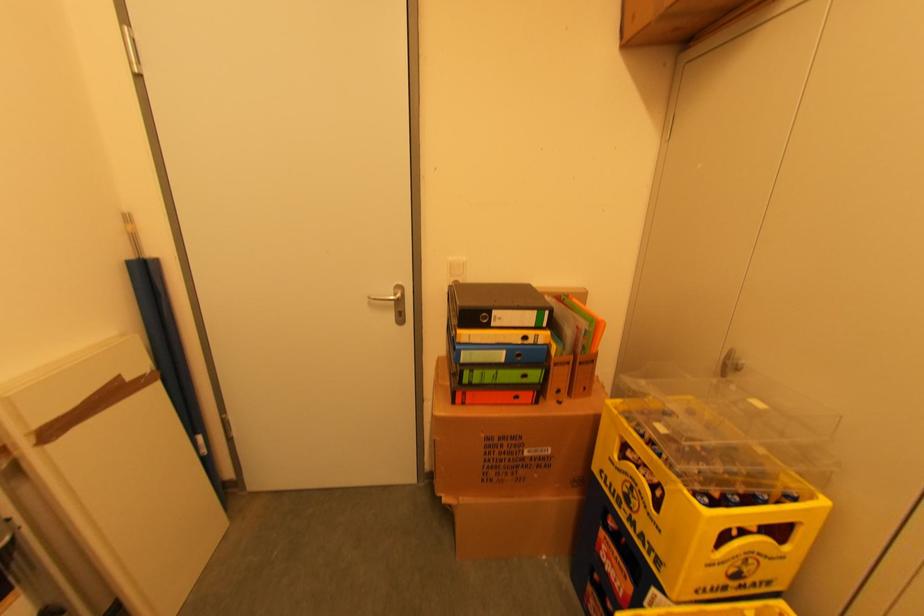
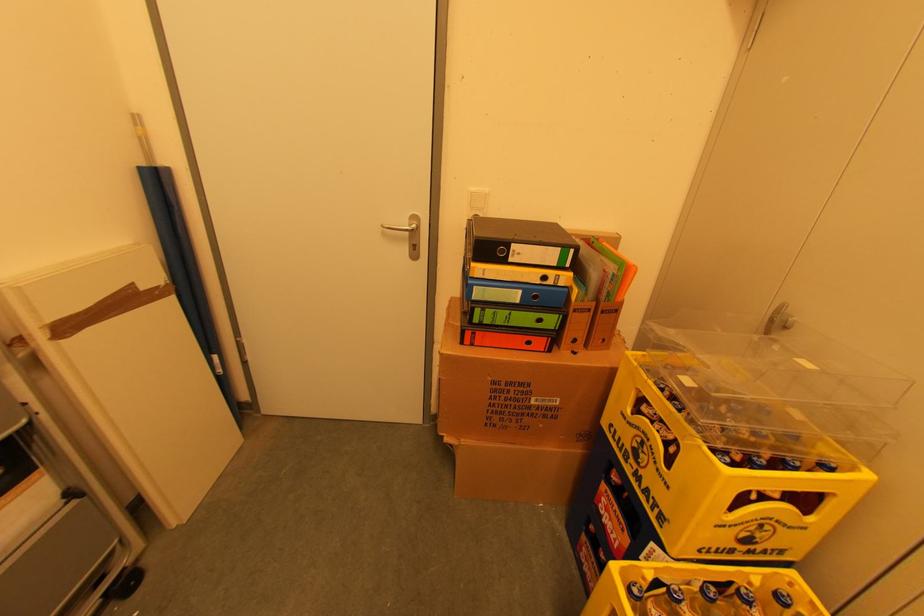
In a continuous first-person perspective shot, in which direction is the camera moving?

The cameraman walked toward right, forward.